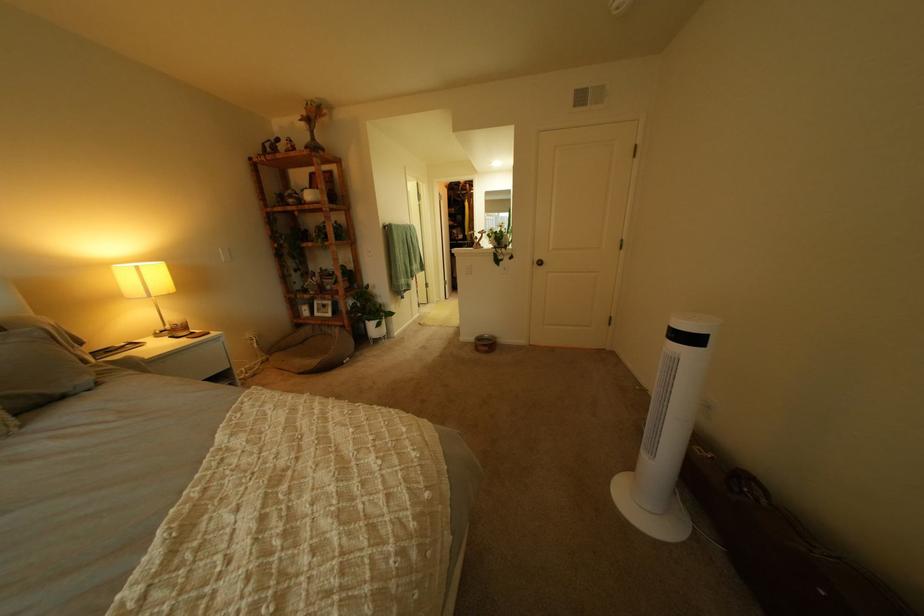
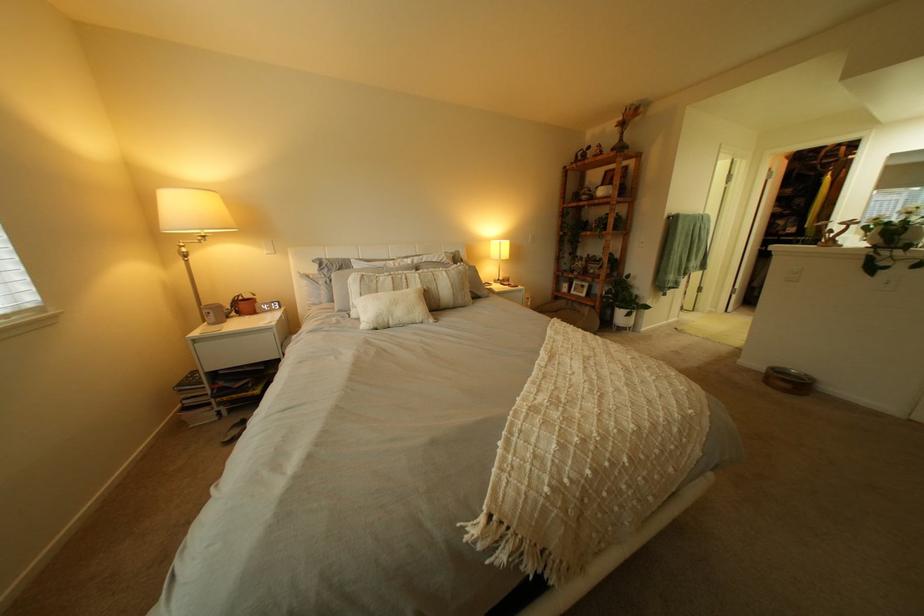
Question: Based on the continuous images, in which direction is the camera rotating? Reply with the corresponding letter.

Choices:
 (A) Left
 (B) Right
 (C) Up
 (D) Down

Answer: (A)